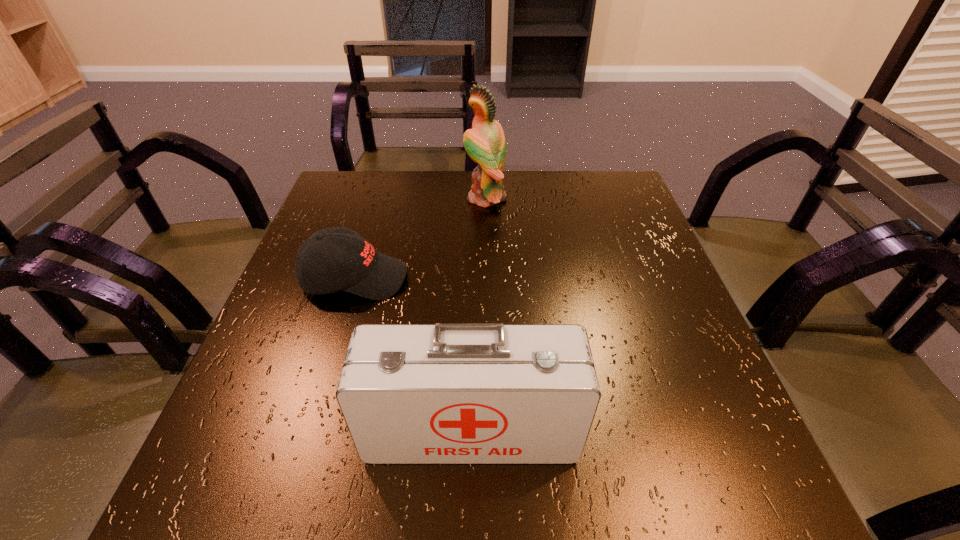
The height and width of the screenshot is (540, 960). Find the location of `object that is at the far edge`. object that is at the far edge is located at coordinates (485, 143).

Identify the location of object that is at the near edge. This screenshot has width=960, height=540. (446, 393).

Find the location of a particular element. The width and height of the screenshot is (960, 540). object at the left edge is located at coordinates (361, 270).

Where is `vacant space at the far edge of the desktop`? vacant space at the far edge of the desktop is located at coordinates (452, 192).

You are a GUI agent. You are given a task and a screenshot of the screen. Output one action in this format:
    pyautogui.click(x=<x>, y=<y>)
    Task: Click on the vacant space at the near edge
    The image size is (960, 540).
    Given the screenshot: What is the action you would take?
    pyautogui.click(x=568, y=492)

The image size is (960, 540). In the image, there is a desktop. What are the coordinates of `blank space at the left edge` in the screenshot? It's located at (314, 315).

In the image, there is a desktop. Where is `vacant space at the right edge`? This screenshot has height=540, width=960. vacant space at the right edge is located at coordinates (703, 362).

Find the location of a particular element. The height and width of the screenshot is (540, 960). vacant space at the far left corner is located at coordinates (354, 191).

The height and width of the screenshot is (540, 960). Identify the location of vacant space at the far right corner of the desktop. (586, 172).

This screenshot has height=540, width=960. Identify the location of vacant area at the near right corner. (762, 504).